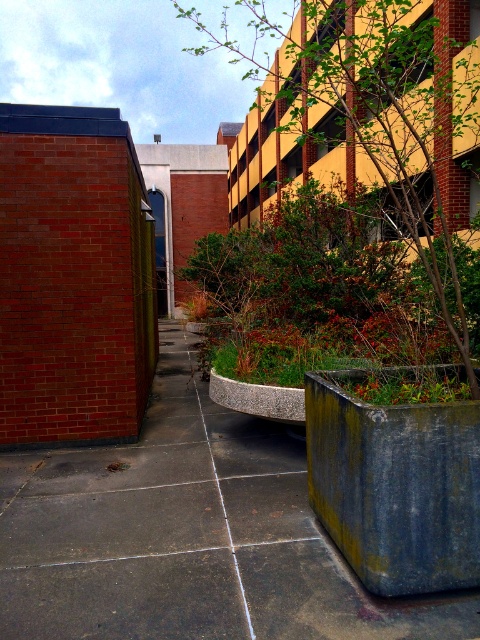
Question: Does concrete pavement at center have a smaller size compared to green leafy tree at upper center?

Choices:
 (A) no
 (B) yes

Answer: (B)

Question: Is concrete pavement at center below green leafy tree at upper center?

Choices:
 (A) no
 (B) yes

Answer: (B)

Question: Is concrete pavement at center to the right of green leafy tree at upper center from the viewer's perspective?

Choices:
 (A) no
 (B) yes

Answer: (B)

Question: Which object is farther from the camera taking this photo?

Choices:
 (A) green leafy tree at upper center
 (B) concrete pavement at center

Answer: (A)